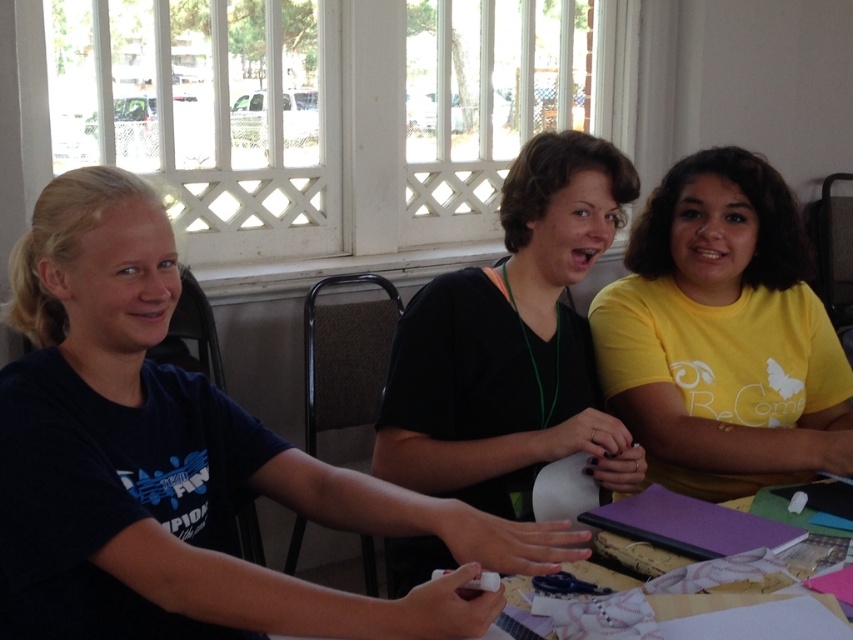
Question: Among these objects, which one is farthest from the camera?

Choices:
 (A) wooden table at center
 (B) black matte shirt at center
 (C) dark blue t-shirt at left
 (D) yellow matte shirt at center

Answer: (D)

Question: Is black matte shirt at center below wooden table at center?

Choices:
 (A) yes
 (B) no

Answer: (B)

Question: Is black matte shirt at center closer to the viewer compared to wooden table at center?

Choices:
 (A) no
 (B) yes

Answer: (A)

Question: Which object appears farthest from the camera in this image?

Choices:
 (A) wooden table at center
 (B) black matte shirt at center

Answer: (B)

Question: Can you confirm if yellow matte shirt at center is positioned below black matte shirt at center?

Choices:
 (A) no
 (B) yes

Answer: (A)

Question: Which of the following is the farthest from the observer?

Choices:
 (A) (592, 451)
 (B) (715, 593)
 (C) (688, 259)

Answer: (C)